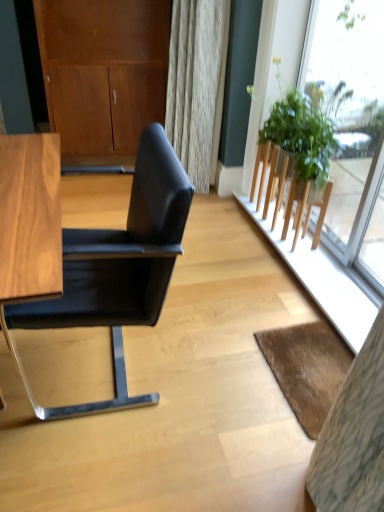
Question: From a real-world perspective, is matte wood dresser at upper left above or below transparent glass window at upper right?

Choices:
 (A) above
 (B) below

Answer: (B)

Question: Based on their positions, is matte wood dresser at upper left located to the left or right of transparent glass window at upper right?

Choices:
 (A) right
 (B) left

Answer: (B)

Question: Estimate the real-world distances between objects in this image. Which object is closer to the black leather chair at left?

Choices:
 (A) green leafy plant at right
 (B) transparent glass window at upper right
 (C) brown textured mat at lower right
 (D) matte wood dresser at upper left

Answer: (C)

Question: Which of these objects is positioned farthest from the black leather chair at left?

Choices:
 (A) transparent glass window at upper right
 (B) matte wood dresser at upper left
 (C) green leafy plant at right
 (D) brown textured mat at lower right

Answer: (B)